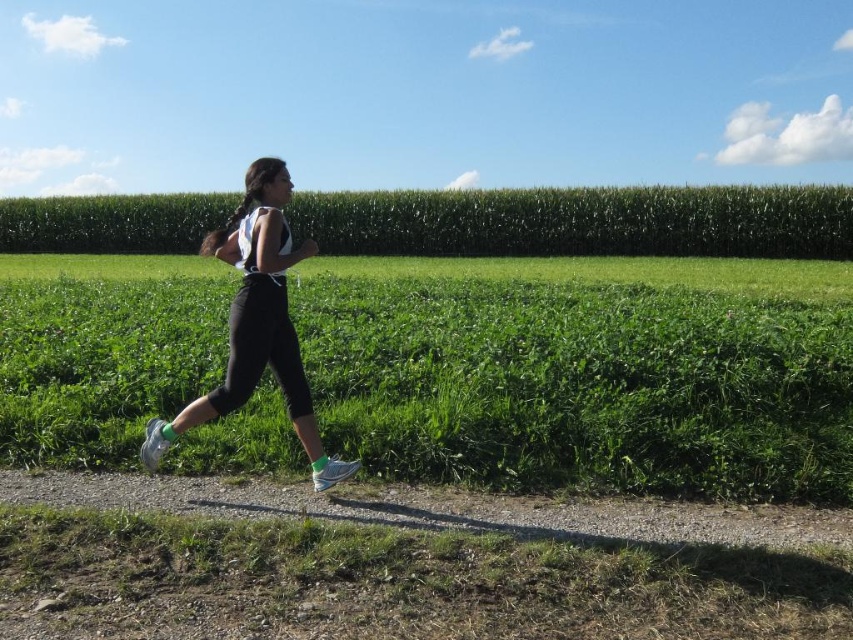
Question: Which point is farther to the camera?

Choices:
 (A) shiny silver shoe at lower left
 (B) green grassy corn field at upper center
 (C) gravel path at center
 (D) white mesh running shoe at lower center

Answer: (B)

Question: Does shiny silver shoe at lower left lie in front of white mesh running shoe at lower center?

Choices:
 (A) yes
 (B) no

Answer: (B)

Question: Estimate the real-world distances between objects in this image. Which object is closer to the green grass at center?

Choices:
 (A) green grassy corn field at upper center
 (B) white matte tank top at center
 (C) gravel path at center

Answer: (B)

Question: Can you confirm if green grass at center is positioned below green grassy corn field at upper center?

Choices:
 (A) yes
 (B) no

Answer: (A)

Question: Which object is positioned closest to the green grass at center?

Choices:
 (A) white matte tank top at center
 (B) white mesh running shoe at lower center
 (C) shiny silver shoe at lower left
 (D) gravel path at center

Answer: (A)

Question: Does green grass at center appear over white matte tank top at center?

Choices:
 (A) yes
 (B) no

Answer: (B)